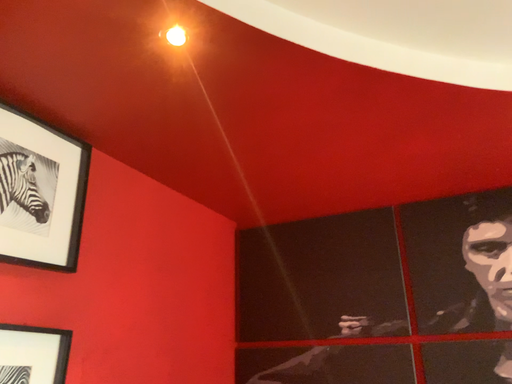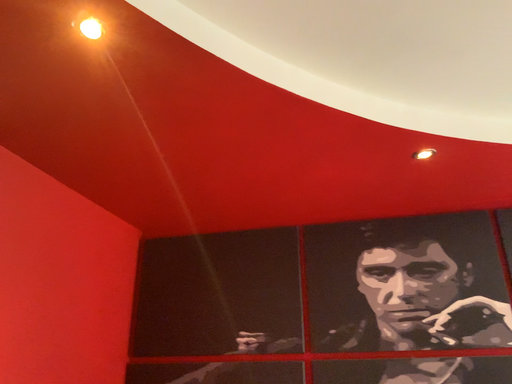
Question: How did the camera likely rotate when shooting the video?

Choices:
 (A) rotated right
 (B) rotated left

Answer: (A)